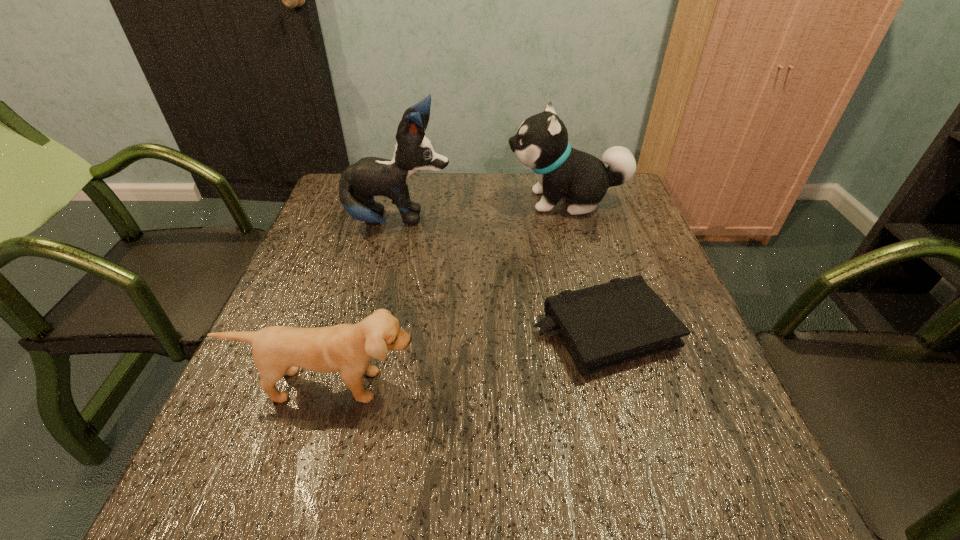
The width and height of the screenshot is (960, 540). Identify the location of the second closest object to the shortest puppy. (370, 176).

This screenshot has width=960, height=540. Identify the location of object that stands as the closest to the tallest object. (541, 143).

The image size is (960, 540). In order to click on puppy that can be found as the closest to the Bible in this screenshot , I will do `click(346, 348)`.

Locate an element on the screen. The width and height of the screenshot is (960, 540). puppy that stands as the third closest to the shortest object is located at coordinates (541, 143).

Identify the location of free space in the image that satisfies the following two spatial constraints: 1. on the front-facing side of the tallest puppy; 2. on the left side of the Bible. (373, 331).

Image resolution: width=960 pixels, height=540 pixels. What are the coordinates of `free space that satisfies the following two spatial constraints: 1. at the face of the third shortest object; 2. on the right side of the shortest object` in the screenshot? It's located at (601, 331).

The width and height of the screenshot is (960, 540). In order to click on free point that satisfies the following two spatial constraints: 1. on the front-facing side of the tallest object; 2. on the right side of the Bible in this screenshot , I will do `click(373, 331)`.

This screenshot has width=960, height=540. In order to click on free spot that satisfies the following two spatial constraints: 1. on the front-facing side of the Bible; 2. on the right side of the tallest puppy in this screenshot , I will do `click(373, 331)`.

This screenshot has width=960, height=540. I want to click on free space that satisfies the following two spatial constraints: 1. on the front-facing side of the Bible; 2. on the left side of the tallest object, so click(373, 331).

What are the coordinates of `vacant space that satisfies the following two spatial constraints: 1. on the front-facing side of the tallest object; 2. on the left side of the nearest puppy` in the screenshot? It's located at tap(360, 385).